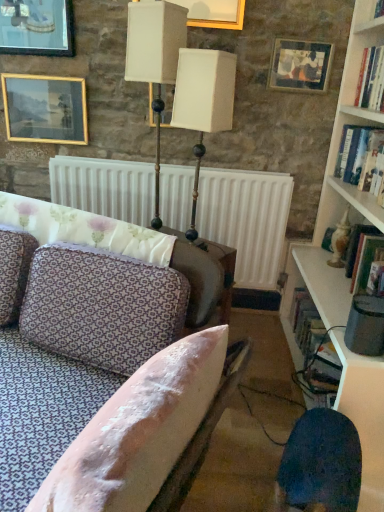
Question: Is gold-framed picture at upper left, which appears as the second picture frame when viewed from the left, outside of metallic gold table lamp at upper center, the 2th table lamp positioned from the right?

Choices:
 (A) yes
 (B) no

Answer: (A)

Question: Is gold-framed picture at upper left, which appears as the second picture frame when viewed from the left, aimed at metallic gold table lamp at upper center, the 2th table lamp positioned from the right?

Choices:
 (A) no
 (B) yes

Answer: (A)

Question: Is gold-framed picture at upper left, which appears as the second picture frame when viewed from the left, to the right of metallic gold table lamp at upper center, the 2th table lamp positioned from the right, from the viewer's perspective?

Choices:
 (A) no
 (B) yes

Answer: (A)

Question: Is the depth of gold-framed picture at upper left, which appears as the second picture frame when viewed from the left, greater than that of metallic gold table lamp at upper center, placed as the 1th table lamp when sorted from left to right?

Choices:
 (A) yes
 (B) no

Answer: (A)

Question: Is gold-framed picture at upper left, the 2th picture frame viewed from the right, smaller than metallic gold table lamp at upper center, placed as the 1th table lamp when sorted from left to right?

Choices:
 (A) yes
 (B) no

Answer: (A)

Question: Is cream matte table lamp at center, marked as the first table lamp in a right-to-left arrangement, inside the boundaries of gold-framed painting at upper left, arranged as the 3th picture frame when viewed from the right, or outside?

Choices:
 (A) outside
 (B) inside

Answer: (A)

Question: From their relative heights in the image, would you say cream matte table lamp at center, the 2th table lamp when ordered from left to right, is taller or shorter than gold-framed painting at upper left, arranged as the 3th picture frame when viewed from the right?

Choices:
 (A) tall
 (B) short

Answer: (A)

Question: From the image's perspective, relative to gold-framed painting at upper left, which is the first picture frame from left to right, is cream matte table lamp at center, the 2th table lamp when ordered from left to right, above or below?

Choices:
 (A) above
 (B) below

Answer: (B)

Question: In the image, is cream matte table lamp at center, the 2th table lamp when ordered from left to right, positioned in front of or behind gold-framed painting at upper left, which is the first picture frame from left to right?

Choices:
 (A) behind
 (B) front

Answer: (B)

Question: Considering their positions, is hardcover book at right, which appears as the third book when viewed from the front, located in front of or behind gold-framed picture at upper left, which appears as the second picture frame when viewed from the left?

Choices:
 (A) behind
 (B) front

Answer: (A)

Question: Is hardcover book at right, marked as the 3th book in a top-to-bottom arrangement, bigger or smaller than gold-framed picture at upper left, which appears as the second picture frame when viewed from the left?

Choices:
 (A) big
 (B) small

Answer: (A)

Question: In terms of height, does hardcover book at right, which is the first book from back to front, look taller or shorter compared to gold-framed picture at upper left, the 2th picture frame viewed from the right?

Choices:
 (A) tall
 (B) short

Answer: (B)

Question: Choose the correct answer: Is hardcover book at right, which appears as the third book when viewed from the front, inside gold-framed picture at upper left, which appears as the second picture frame when viewed from the left, or outside it?

Choices:
 (A) inside
 (B) outside

Answer: (B)

Question: Is hardcover book at right, which is the first book from back to front, in front of or behind patterned fabric couch at center in the image?

Choices:
 (A) behind
 (B) front

Answer: (A)

Question: In terms of width, does hardcover book at right, which appears as the third book when viewed from the right, look wider or thinner when compared to patterned fabric couch at center?

Choices:
 (A) wide
 (B) thin

Answer: (B)